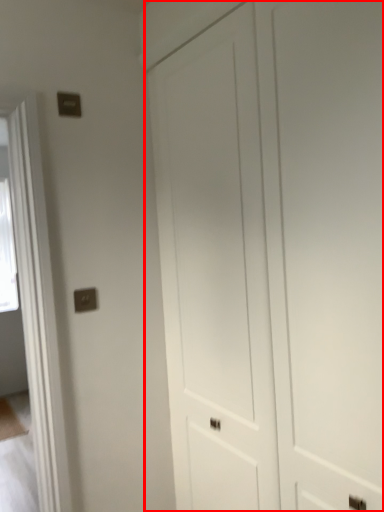
Question: In this image, where is door (annotated by the red box) located relative to electric outlet?

Choices:
 (A) right
 (B) left

Answer: (A)